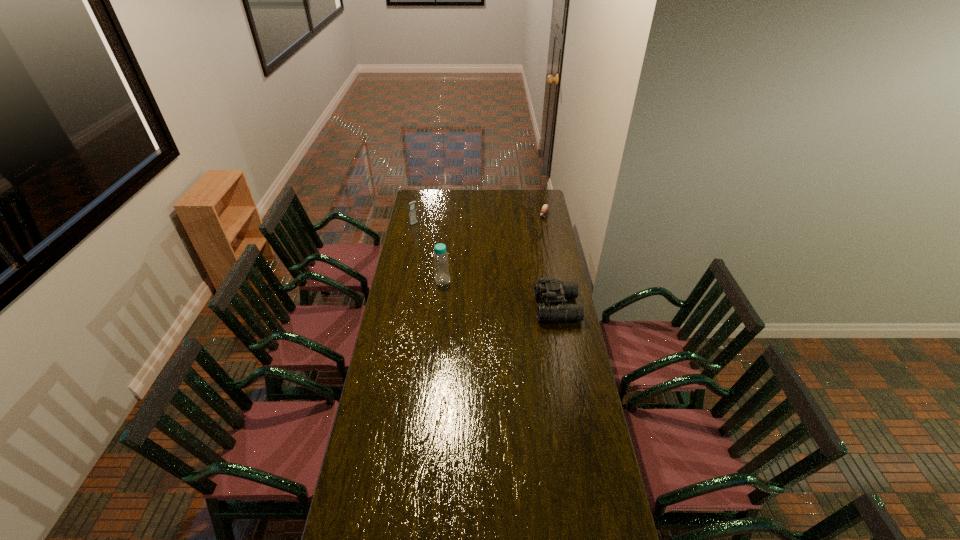
Image resolution: width=960 pixels, height=540 pixels. Identify the location of vacant space located through the lenses of the binoculars. (493, 307).

The width and height of the screenshot is (960, 540). I want to click on free location located 0.160m on the front-facing side of the cellular telephone, so click(431, 238).

In order to click on free space located 0.120m on the front-facing side of the cellular telephone in this screenshot , I will do `click(427, 234)`.

Where is `vacant point located on the front-facing side of the cellular telephone`? The height and width of the screenshot is (540, 960). vacant point located on the front-facing side of the cellular telephone is located at coordinates (447, 250).

Locate an element on the screen. Image resolution: width=960 pixels, height=540 pixels. vacant area located on the front-facing side of the escargot is located at coordinates (537, 227).

The height and width of the screenshot is (540, 960). Find the location of `vacant space situated 0.200m on the front-facing side of the escargot`. vacant space situated 0.200m on the front-facing side of the escargot is located at coordinates (530, 236).

Locate an element on the screen. This screenshot has width=960, height=540. vacant space located on the front-facing side of the escargot is located at coordinates (528, 238).

Identify the location of object that is at the left edge. (412, 212).

Locate an element on the screen. binoculars located in the right edge section of the desktop is located at coordinates (553, 290).

Locate an element on the screen. This screenshot has height=540, width=960. escargot at the right edge is located at coordinates (545, 207).